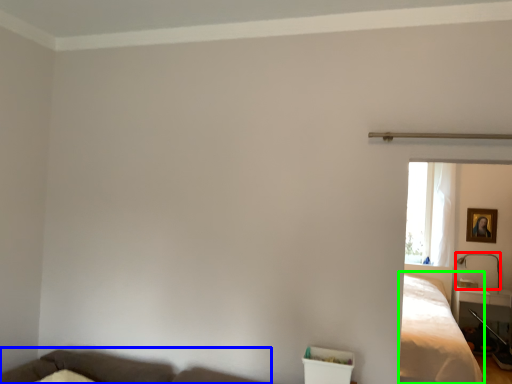
Question: Which is farther away from lamp (highlighted by a red box)? couch (highlighted by a blue box) or bed (highlighted by a green box)?

Choices:
 (A) couch
 (B) bed

Answer: (A)